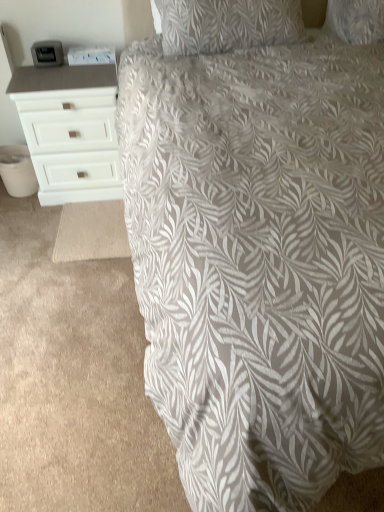
Find the location of a particular element. free space above white matte chest of drawers at left (from a real-world perspective) is located at coordinates (71, 64).